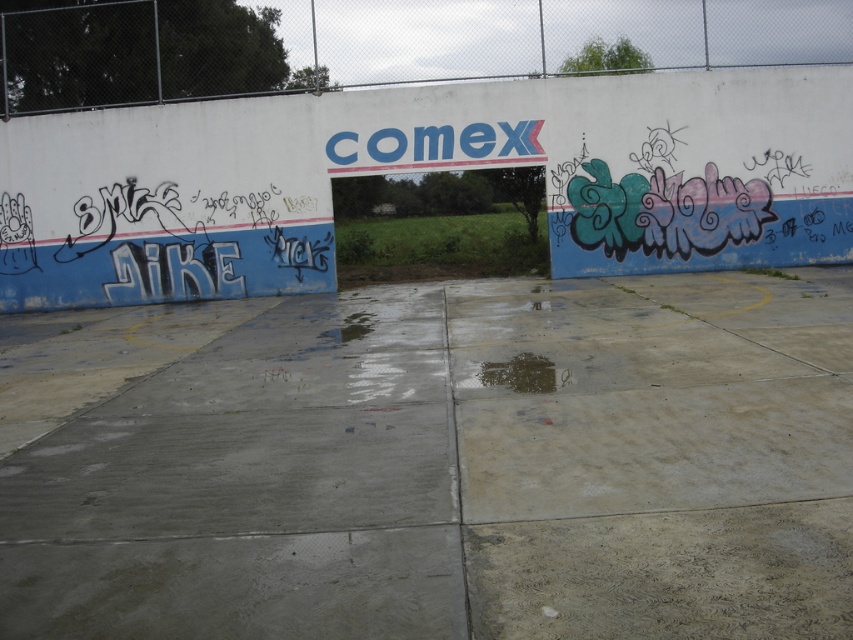
You are standing in front of the wall with the COMEX sign. There are two points marked on the wall. The first point is at coordinates point (126, 45) and the second point is at point (538, 364). Which point is closer to you?

Point (126, 45) is further to the camera than point (538, 364), so the second point is closer to you.

You are standing in front of the wall described. If you want to touch the gray concrete at center, where should you move your hand relative to the COMEX letters?

The gray concrete at center is located at point coordinates, so you should move your hand to that position relative to the COMEX letters.